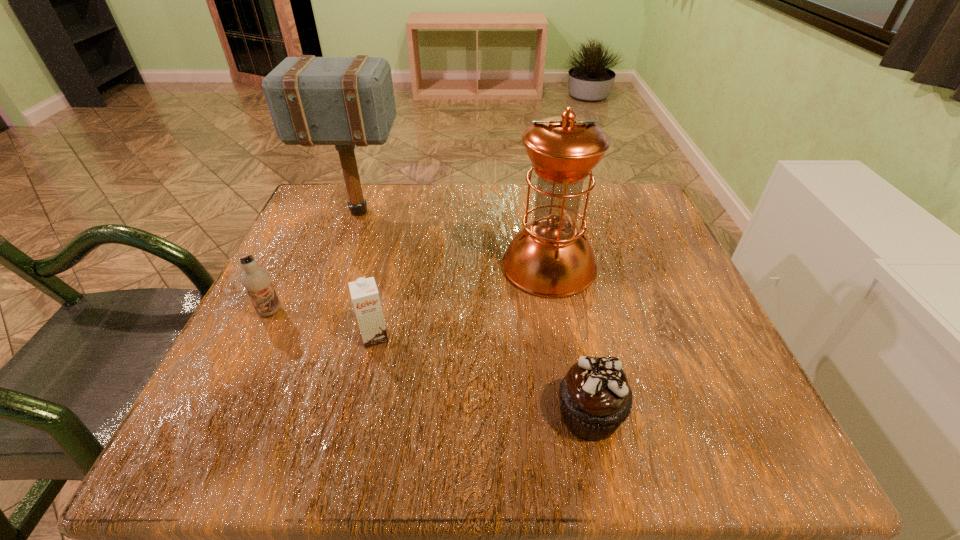
Where is `vacant area situated 0.400m on the right of the farther chocolate milk`? The height and width of the screenshot is (540, 960). vacant area situated 0.400m on the right of the farther chocolate milk is located at coordinates (500, 312).

Find the location of a particular element. This screenshot has width=960, height=540. vacant position located on the back of the right chocolate milk is located at coordinates tap(393, 258).

The height and width of the screenshot is (540, 960). What are the coordinates of `vacant region located on the left of the nearest object` in the screenshot? It's located at (299, 415).

The width and height of the screenshot is (960, 540). I want to click on mallet present at the far edge, so click(344, 101).

At what (x,y) coordinates should I click in order to perform the action: click on oil lamp that is at the far edge. Please return your answer as a coordinate pair (x, y). Looking at the image, I should click on (550, 257).

You are a GUI agent. You are given a task and a screenshot of the screen. Output one action in this format:
    pyautogui.click(x=<x>, y=<y>)
    Task: Click on the object that is at the near edge
    The width and height of the screenshot is (960, 540).
    Given the screenshot: What is the action you would take?
    pyautogui.click(x=595, y=398)

The width and height of the screenshot is (960, 540). What are the coordinates of `mallet situated at the left edge` in the screenshot? It's located at (344, 101).

The height and width of the screenshot is (540, 960). Identify the location of chocolate milk that is at the left edge. (257, 281).

The image size is (960, 540). What are the coordinates of `object that is at the far left corner` in the screenshot? It's located at 344,101.

Locate an element on the screen. This screenshot has width=960, height=540. blank space at the far edge is located at coordinates (474, 224).